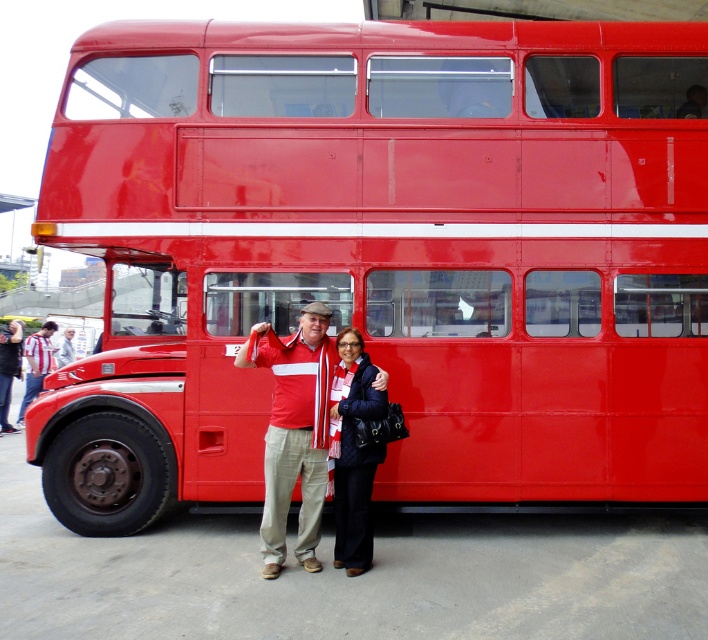
Is matte red shirt at center above striped fabric shirt at left?

Actually, matte red shirt at center is below striped fabric shirt at left.

Is point (292, 467) closer to viewer compared to point (52, 332)?

Yes, point (292, 467) is in front of point (52, 332).

Image resolution: width=708 pixels, height=640 pixels. I want to click on matte red shirt at center, so click(295, 429).

The image size is (708, 640). What are the coordinates of `matte red shirt at center` in the screenshot? It's located at (295, 429).

Which is more to the right, matte red shirt at center or quilted black jacket at lower center?

quilted black jacket at lower center

Locate an element on the screen. matte red shirt at center is located at coordinates (295, 429).

I want to click on matte red shirt at center, so click(295, 429).

Is quilted black jacket at lower center smaller than striped fabric shirt at left?

Correct, quilted black jacket at lower center occupies less space than striped fabric shirt at left.

Is point (365, 529) positioned before point (42, 349)?

Yes, point (365, 529) is in front of point (42, 349).

At what (x,y) coordinates should I click in order to perform the action: click on quilted black jacket at lower center. Please return your answer as a coordinate pair (x, y). This screenshot has height=640, width=708. Looking at the image, I should click on (355, 458).